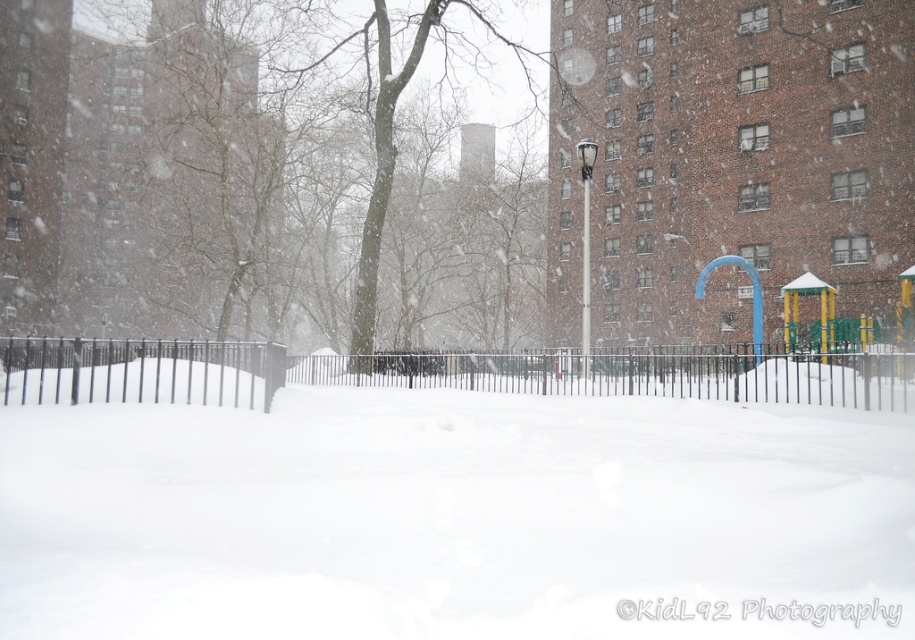
In the scene shown: You are standing at the point marked as point [449,508] in the snowy urban park scene. What is the terrain like at that exact location?

The terrain at point [449,508] is white fluffy snow at center.

You are a child trying to build a snowman using the white fluffy snow at center. The black metal fence at center is in your way. Can you move the snow over the fence?

The white fluffy snow at center is taller than the black metal fence at center, so yes, you can move the snow over the fence since it is taller than the fence.

You are standing in the snowy urban park and want to place a small snowman exactly at the center of the white fluffy snow at center. According to the coordinates provided, where should you position the snowman?

The white fluffy snow at center is located at point (x=449, y=508), so you should position the snowman exactly at those coordinates to place it at the center of the white fluffy snow at center.